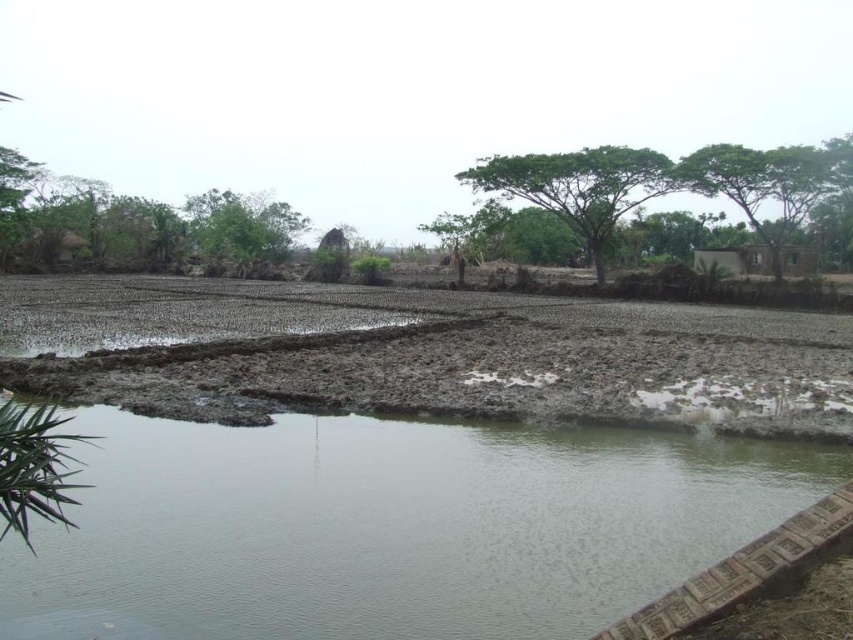
Between clear water at bottom and brown muddy field at center, which one is positioned higher?

Positioned higher is brown muddy field at center.

Is point (283, 600) less distant than point (74, 284)?

Yes, point (283, 600) is in front of point (74, 284).

Is point (741, 486) positioned in front of point (15, 323)?

Yes, point (741, 486) is in front of point (15, 323).

Find the location of `clear water at bottom`. clear water at bottom is located at coordinates (389, 528).

Between brown muddy field at center and green leafy tree at center, which one is positioned higher?

green leafy tree at center is higher up.

Does brown muddy field at center have a larger size compared to green leafy tree at center?

No, brown muddy field at center is not bigger than green leafy tree at center.

Is point (155, 276) positioned in front of point (573, 196)?

That is False.

Identify the location of brown muddy field at center. Image resolution: width=853 pixels, height=640 pixels. (433, 355).

Consider the image. Is clear water at bottom smaller than green leafy tree at upper right?

Correct, clear water at bottom occupies less space than green leafy tree at upper right.

Does clear water at bottom have a greater height compared to green leafy tree at upper right?

Incorrect, clear water at bottom's height is not larger of green leafy tree at upper right's.

Is point (791, 496) behind point (758, 150)?

No, (791, 496) is closer to viewer.

Locate an element on the screen. This screenshot has height=640, width=853. clear water at bottom is located at coordinates (389, 528).